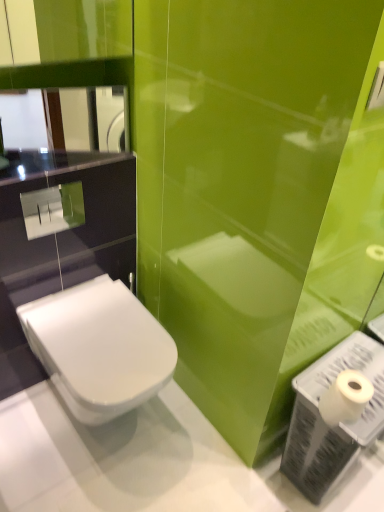
Question: Can you confirm if white glossy toilet at lower left is taller than glossy glass mirror at upper left?

Choices:
 (A) yes
 (B) no

Answer: (A)

Question: Considering the relative positions of white glossy toilet at lower left and glossy glass mirror at upper left in the image provided, is white glossy toilet at lower left to the left of glossy glass mirror at upper left from the viewer's perspective?

Choices:
 (A) no
 (B) yes

Answer: (A)

Question: Is white glossy toilet at lower left behind glossy glass mirror at upper left?

Choices:
 (A) no
 (B) yes

Answer: (A)

Question: Is white glossy toilet at lower left touching glossy glass mirror at upper left?

Choices:
 (A) yes
 (B) no

Answer: (B)

Question: From a real-world perspective, is white glossy toilet at lower left beneath glossy glass mirror at upper left?

Choices:
 (A) no
 (B) yes

Answer: (B)

Question: Visually, is white glossy toilet at lower left positioned to the left or to the right of white matte toilet paper at lower right?

Choices:
 (A) left
 (B) right

Answer: (A)

Question: Is white glossy toilet at lower left in front of or behind white matte toilet paper at lower right in the image?

Choices:
 (A) behind
 (B) front

Answer: (A)

Question: From their relative heights in the image, would you say white glossy toilet at lower left is taller or shorter than white matte toilet paper at lower right?

Choices:
 (A) tall
 (B) short

Answer: (A)

Question: Is white glossy toilet at lower left bigger or smaller than white matte toilet paper at lower right?

Choices:
 (A) big
 (B) small

Answer: (A)

Question: Is white matte toilet paper at lower right in front of or behind white plastic toilet paper at lower right in the image?

Choices:
 (A) behind
 (B) front

Answer: (B)

Question: From the image's perspective, is white matte toilet paper at lower right located above or below white plastic toilet paper at lower right?

Choices:
 (A) below
 (B) above

Answer: (B)

Question: From a real-world perspective, relative to white plastic toilet paper at lower right, is white matte toilet paper at lower right vertically above or below?

Choices:
 (A) above
 (B) below

Answer: (A)

Question: Is white matte toilet paper at lower right wider or thinner than white plastic toilet paper at lower right?

Choices:
 (A) thin
 (B) wide

Answer: (A)

Question: In the image, is glossy glass mirror at upper left on the left side or the right side of white matte toilet paper at lower right?

Choices:
 (A) right
 (B) left

Answer: (B)

Question: From a real-world perspective, is glossy glass mirror at upper left physically located above or below white matte toilet paper at lower right?

Choices:
 (A) below
 (B) above

Answer: (B)